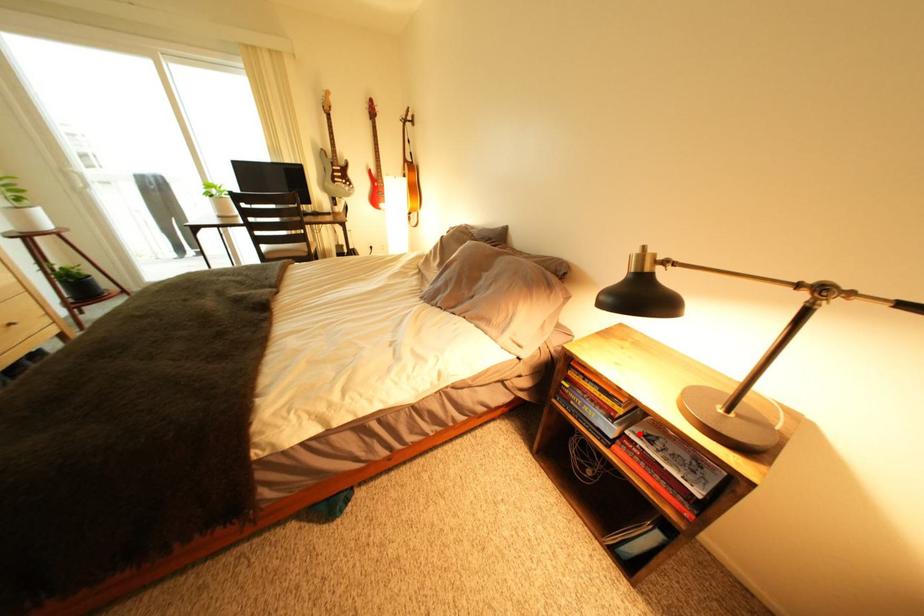
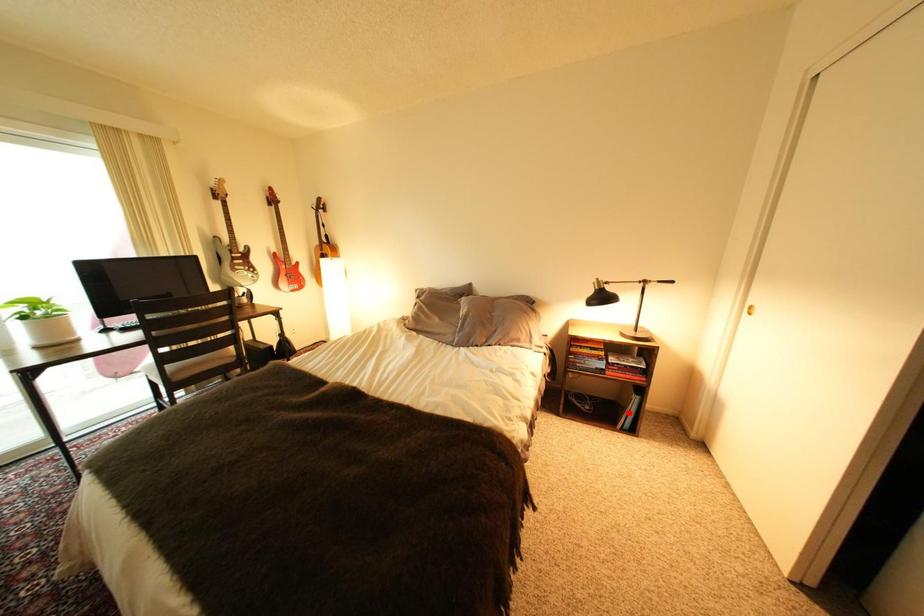
I am providing you with two images of the same scene from different viewpoints. A red point is marked on the first image and another point is marked on the second image. Does the point marked in image1 correspond to the same location as the one in image2?

No